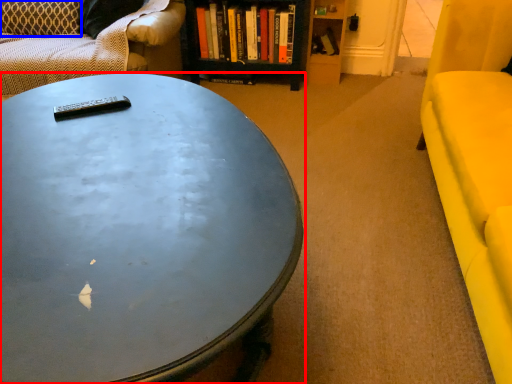
Question: Which object is closer to the camera taking this photo, coffee table (highlighted by a red box) or pillow (highlighted by a blue box)?

Choices:
 (A) coffee table
 (B) pillow

Answer: (A)